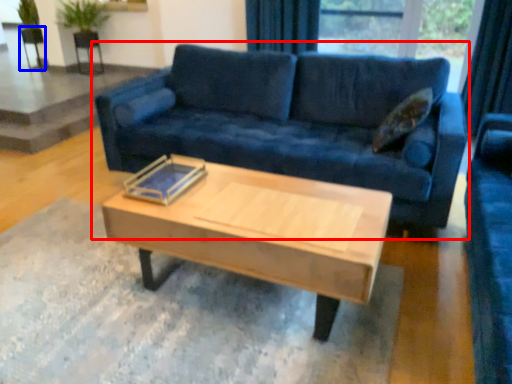
Question: Among these objects, which one is nearest to the camera, studio couch (highlighted by a red box) or armchair (highlighted by a blue box)?

Choices:
 (A) studio couch
 (B) armchair

Answer: (A)